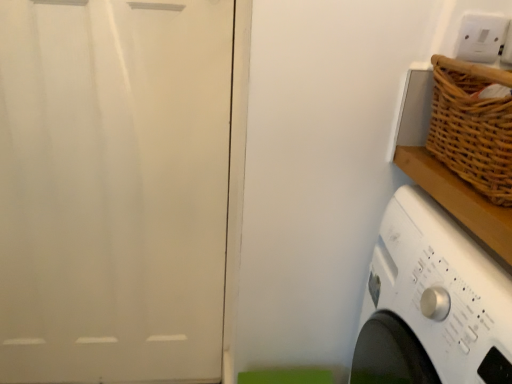
Question: Is white glossy screen door at left in front of or behind white plastic electric outlet at upper right in the image?

Choices:
 (A) front
 (B) behind

Answer: (B)

Question: Visually, is white glossy screen door at left positioned to the left or to the right of white plastic electric outlet at upper right?

Choices:
 (A) right
 (B) left

Answer: (B)

Question: Which of these objects is positioned farthest from the white plastic electric outlet at upper right?

Choices:
 (A) woven brown basket at upper right
 (B) white plastic washing machine at lower right
 (C) white glossy screen door at left

Answer: (C)

Question: Which object is positioned closest to the woven brown basket at upper right?

Choices:
 (A) white plastic washing machine at lower right
 (B) white glossy screen door at left
 (C) white plastic electric outlet at upper right

Answer: (C)